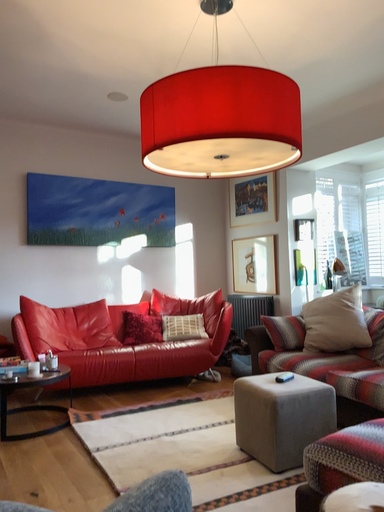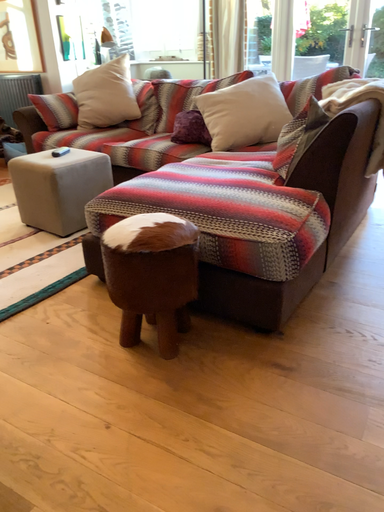
Question: Which way did the camera rotate in the video?

Choices:
 (A) rotated upward
 (B) rotated downward

Answer: (B)